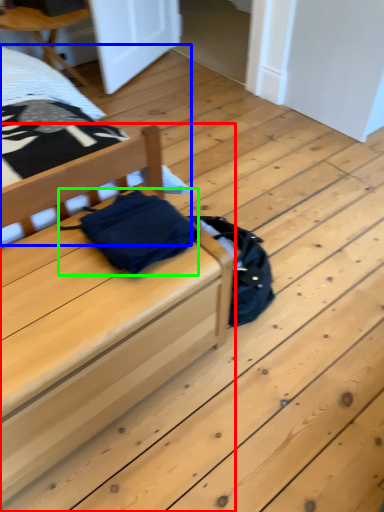
Question: Which object is the closest to the furniture (highlighted by a red box)? Choose among these: bed (highlighted by a blue box) or material (highlighted by a green box).

Choices:
 (A) bed
 (B) material

Answer: (B)